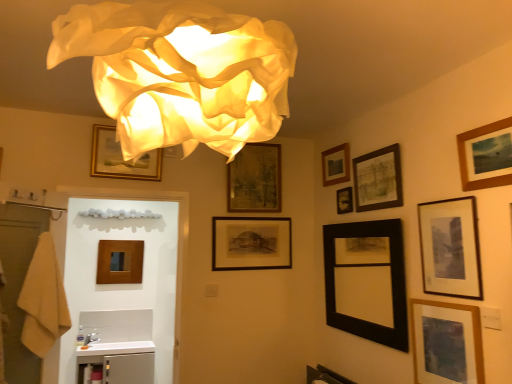
Question: In terms of height, does white fabric lamp at upper center look taller or shorter compared to black matte picture frame at center, the 3th picture frame when ordered from left to right?

Choices:
 (A) short
 (B) tall

Answer: (B)

Question: Looking at the image, does white fabric lamp at upper center seem bigger or smaller compared to black matte picture frame at center, the 3th picture frame when ordered from left to right?

Choices:
 (A) big
 (B) small

Answer: (A)

Question: Based on their relative distances, which object is farther from the beige cotton bath towel at left?

Choices:
 (A) wooden picture frame at upper center, the 5th picture frame positioned from the left
 (B) black matte picture frame at upper center, placed as the 6th picture frame when sorted from right to left
 (C) white glossy sink at lower left
 (D) wooden picture frame at lower right, the third picture frame positioned from the right
 (E) black matte picture frame at upper right, positioned as the tenth picture frame in left-to-right order

Answer: (E)

Question: Estimate the real-world distances between objects in this image. Which object is farther from the wooden picture frame at center, marked as the 11th picture frame in a right-to-left arrangement?

Choices:
 (A) wooden picture frame at lower right, which appears as the 9th picture frame when viewed from the left
 (B) gold-framed picture at upper center, which ranks as the second picture frame in left-to-right order
 (C) beige cotton bath towel at left
 (D) black matte picture frame at center, the 3th picture frame when ordered from left to right
 (E) wooden framed picture at upper right, which appears as the eleventh picture frame when viewed from the left

Answer: (E)